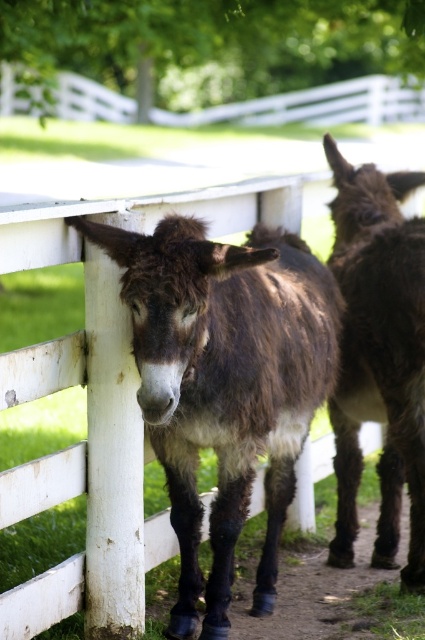
Question: Can you confirm if brown fuzzy mule at center is wider than white wooden rail at upper center?

Choices:
 (A) no
 (B) yes

Answer: (A)

Question: Among these points, which one is nearest to the camera?

Choices:
 (A) (68, 108)
 (B) (422, 298)

Answer: (B)

Question: Does brown fuzzy donkey at center appear under white wooden rail at upper center?

Choices:
 (A) no
 (B) yes

Answer: (B)

Question: Which of these objects is positioned farthest from the white wooden rail at upper center?

Choices:
 (A) brown fuzzy mule at center
 (B) brown fuzzy donkey at center

Answer: (B)

Question: Is brown fuzzy donkey at center closer to camera compared to white wooden rail at upper center?

Choices:
 (A) no
 (B) yes

Answer: (B)

Question: Which point is closer to the camera taking this photo?

Choices:
 (A) (184, 294)
 (B) (348, 81)
 (C) (401, 282)

Answer: (A)